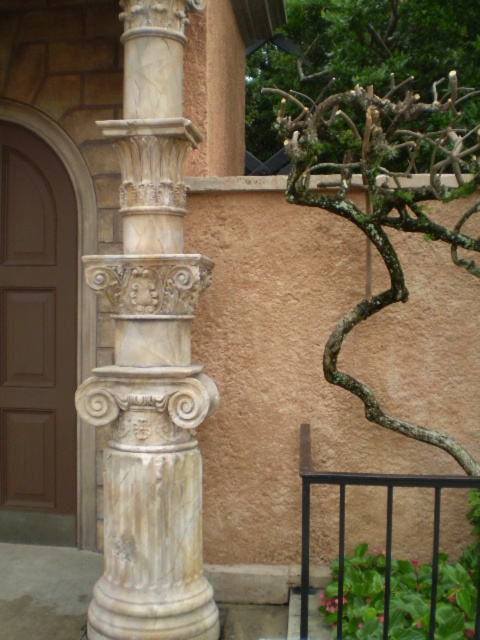
Question: Does white marble column at center appear under bare branches at upper right?

Choices:
 (A) yes
 (B) no

Answer: (A)

Question: Does white marble column at center have a greater width compared to bare branches at upper right?

Choices:
 (A) yes
 (B) no

Answer: (B)

Question: Which point is farther to the camera?

Choices:
 (A) bare branches at upper right
 (B) white marble column at center

Answer: (A)

Question: Which object is farther from the camera taking this photo?

Choices:
 (A) bare branches at upper right
 (B) white marble column at center

Answer: (A)

Question: Can you confirm if white marble column at center is positioned above bare branches at upper right?

Choices:
 (A) no
 (B) yes

Answer: (A)